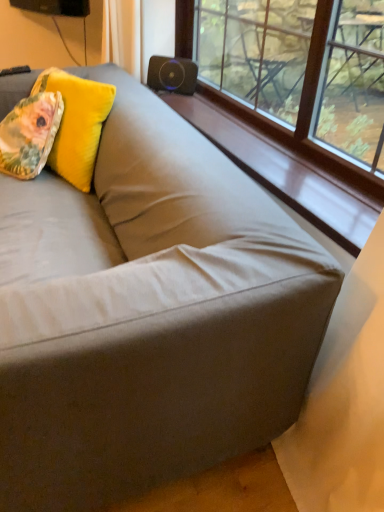
Identify the location of black matte speaker at upper center. Image resolution: width=384 pixels, height=512 pixels. point(172,74).

Image resolution: width=384 pixels, height=512 pixels. Describe the element at coordinates (30, 134) in the screenshot. I see `floral fabric pillow at upper left, the 2th throw pillow when ordered from back to front` at that location.

Find the location of a particular element. The image size is (384, 512). black matte speaker at upper center is located at coordinates (172, 74).

Considering the relative positions of wooden at upper center and fluffy yellow pillow at upper left, the second throw pillow viewed from the front, in the image provided, is wooden at upper center to the left of fluffy yellow pillow at upper left, the second throw pillow viewed from the front, from the viewer's perspective?

No.

Does wooden at upper center have a lesser width compared to fluffy yellow pillow at upper left, which appears as the 1th throw pillow when viewed from the back?

In fact, wooden at upper center might be wider than fluffy yellow pillow at upper left, which appears as the 1th throw pillow when viewed from the back.

Locate an element on the screen. This screenshot has height=512, width=384. window sill directly beneath the fluffy yellow pillow at upper left, the second throw pillow viewed from the front (from a real-world perspective) is located at coordinates (284, 170).

Is wooden at upper center looking in the opposite direction of fluffy yellow pillow at upper left, the second throw pillow viewed from the front?

No, wooden at upper center is not facing the opposite direction of fluffy yellow pillow at upper left, the second throw pillow viewed from the front.

Which object is further away from the camera, black matte speaker at upper center or wooden at upper center?

black matte speaker at upper center is further away from the camera.

Is black matte speaker at upper center thinner than wooden at upper center?

Indeed, black matte speaker at upper center has a lesser width compared to wooden at upper center.

Are black matte speaker at upper center and wooden at upper center far apart?

No.

Is wooden at upper center at the back of black matte speaker at upper center?

No.

From a real-world perspective, is black matte speaker at upper center physically below fluffy yellow pillow at upper left, which appears as the 1th throw pillow when viewed from the back?

No, from a real-world perspective, black matte speaker at upper center is not under fluffy yellow pillow at upper left, which appears as the 1th throw pillow when viewed from the back.

Considering the sizes of objects black matte speaker at upper center and fluffy yellow pillow at upper left, the second throw pillow viewed from the front, in the image provided, who is smaller, black matte speaker at upper center or fluffy yellow pillow at upper left, the second throw pillow viewed from the front,?

black matte speaker at upper center is smaller.

Can you confirm if black matte speaker at upper center is wider than fluffy yellow pillow at upper left, the second throw pillow viewed from the front?

No, black matte speaker at upper center is not wider than fluffy yellow pillow at upper left, the second throw pillow viewed from the front.

Which object is further away from the camera, black matte speaker at upper center or fluffy yellow pillow at upper left, which appears as the 1th throw pillow when viewed from the back?

black matte speaker at upper center.

How far apart are floral fabric pillow at upper left, the 2th throw pillow when ordered from back to front, and wooden at upper center?

71.03 centimeters.

Would you consider floral fabric pillow at upper left, the first throw pillow in the front-to-back sequence, to be distant from wooden at upper center?

No, floral fabric pillow at upper left, the first throw pillow in the front-to-back sequence, is not far from wooden at upper center.

In terms of width, does floral fabric pillow at upper left, the 2th throw pillow when ordered from back to front, look wider or thinner when compared to wooden at upper center?

floral fabric pillow at upper left, the 2th throw pillow when ordered from back to front, is wider than wooden at upper center.

Is floral fabric pillow at upper left, the 2th throw pillow when ordered from back to front, positioned behind wooden at upper center?

Yes, it is.

Locate an element on the screen. window sill in front of the floral fabric pillow at upper left, the first throw pillow in the front-to-back sequence is located at coordinates (284, 170).

Is wooden at upper center taller or shorter than floral fabric pillow at upper left, the first throw pillow in the front-to-back sequence?

In the image, wooden at upper center appears to be shorter than floral fabric pillow at upper left, the first throw pillow in the front-to-back sequence.

Is wooden at upper center smaller than floral fabric pillow at upper left, the 2th throw pillow when ordered from back to front?

No, wooden at upper center is not smaller than floral fabric pillow at upper left, the 2th throw pillow when ordered from back to front.

From a real-world perspective, relative to floral fabric pillow at upper left, the 2th throw pillow when ordered from back to front, is wooden at upper center vertically above or below?

Clearly, from a real-world perspective, wooden at upper center is below floral fabric pillow at upper left, the 2th throw pillow when ordered from back to front.

How distant is fluffy yellow pillow at upper left, the second throw pillow viewed from the front, from black matte speaker at upper center?

fluffy yellow pillow at upper left, the second throw pillow viewed from the front, is 56.65 centimeters away from black matte speaker at upper center.

Considering the relative sizes of fluffy yellow pillow at upper left, the second throw pillow viewed from the front, and black matte speaker at upper center in the image provided, is fluffy yellow pillow at upper left, the second throw pillow viewed from the front, taller than black matte speaker at upper center?

Correct, fluffy yellow pillow at upper left, the second throw pillow viewed from the front, is much taller as black matte speaker at upper center.

Could you tell me if fluffy yellow pillow at upper left, the second throw pillow viewed from the front, is facing black matte speaker at upper center?

No, fluffy yellow pillow at upper left, the second throw pillow viewed from the front, is not oriented towards black matte speaker at upper center.

Find the location of `speaker on the right of fluffy yellow pillow at upper left, which appears as the 1th throw pillow when viewed from the back`. speaker on the right of fluffy yellow pillow at upper left, which appears as the 1th throw pillow when viewed from the back is located at coordinates (172, 74).

Is fluffy yellow pillow at upper left, which appears as the 1th throw pillow when viewed from the back, facing towards wooden at upper center?

No.

How far apart are fluffy yellow pillow at upper left, which appears as the 1th throw pillow when viewed from the back, and wooden at upper center?

fluffy yellow pillow at upper left, which appears as the 1th throw pillow when viewed from the back, and wooden at upper center are 54.40 centimeters apart.

Does fluffy yellow pillow at upper left, the second throw pillow viewed from the front, have a lesser height compared to wooden at upper center?

No, fluffy yellow pillow at upper left, the second throw pillow viewed from the front, is not shorter than wooden at upper center.

The width and height of the screenshot is (384, 512). What are the coordinates of `window sill in front of the fluffy yellow pillow at upper left, the second throw pillow viewed from the front` in the screenshot? It's located at (284, 170).

There is a wooden at upper center. Where is `the 2nd throw pillow above it (from the image's perspective)`? This screenshot has height=512, width=384. the 2nd throw pillow above it (from the image's perspective) is located at coordinates (76, 124).

This screenshot has height=512, width=384. There is a wooden at upper center. Find the location of `speaker above it (from a real-world perspective)`. speaker above it (from a real-world perspective) is located at coordinates (172, 74).

Estimate the real-world distances between objects in this image. Which object is further from fluffy yellow pillow at upper left, the second throw pillow viewed from the front, floral fabric pillow at upper left, the first throw pillow in the front-to-back sequence, or black matte speaker at upper center?

black matte speaker at upper center is positioned further to the anchor fluffy yellow pillow at upper left, the second throw pillow viewed from the front.

From the image, which object appears to be farther from fluffy yellow pillow at upper left, the second throw pillow viewed from the front, black matte speaker at upper center or wooden at upper center?

Based on the image, black matte speaker at upper center appears to be further to fluffy yellow pillow at upper left, the second throw pillow viewed from the front.

Which object lies nearer to the anchor point floral fabric pillow at upper left, the first throw pillow in the front-to-back sequence, wooden at upper center or black matte speaker at upper center?

black matte speaker at upper center is closer to floral fabric pillow at upper left, the first throw pillow in the front-to-back sequence.

Looking at the image, which one is located further to fluffy yellow pillow at upper left, which appears as the 1th throw pillow when viewed from the back, wooden at upper center or black matte speaker at upper center?

black matte speaker at upper center lies further to fluffy yellow pillow at upper left, which appears as the 1th throw pillow when viewed from the back, than the other object.

Considering their positions, is wooden at upper center positioned closer to fluffy yellow pillow at upper left, the second throw pillow viewed from the front, than floral fabric pillow at upper left, the 2th throw pillow when ordered from back to front?

The object closer to fluffy yellow pillow at upper left, the second throw pillow viewed from the front, is floral fabric pillow at upper left, the 2th throw pillow when ordered from back to front.

Considering their positions, is fluffy yellow pillow at upper left, which appears as the 1th throw pillow when viewed from the back, positioned closer to black matte speaker at upper center than floral fabric pillow at upper left, the 2th throw pillow when ordered from back to front?

The object closer to black matte speaker at upper center is fluffy yellow pillow at upper left, which appears as the 1th throw pillow when viewed from the back.

Estimate the real-world distances between objects in this image. Which object is closer to fluffy yellow pillow at upper left, the second throw pillow viewed from the front, floral fabric pillow at upper left, the 2th throw pillow when ordered from back to front, or wooden at upper center?

Based on the image, floral fabric pillow at upper left, the 2th throw pillow when ordered from back to front, appears to be nearer to fluffy yellow pillow at upper left, the second throw pillow viewed from the front.

When comparing their distances from wooden at upper center, does floral fabric pillow at upper left, the first throw pillow in the front-to-back sequence, or fluffy yellow pillow at upper left, the second throw pillow viewed from the front, seem closer?

Among the two, fluffy yellow pillow at upper left, the second throw pillow viewed from the front, is located nearer to wooden at upper center.

Find the location of a particular element. This screenshot has width=384, height=512. throw pillow situated between floral fabric pillow at upper left, the 2th throw pillow when ordered from back to front, and black matte speaker at upper center from left to right is located at coordinates (76, 124).

The image size is (384, 512). In order to click on throw pillow between floral fabric pillow at upper left, the first throw pillow in the front-to-back sequence, and wooden at upper center, in the horizontal direction in this screenshot , I will do `click(76, 124)`.